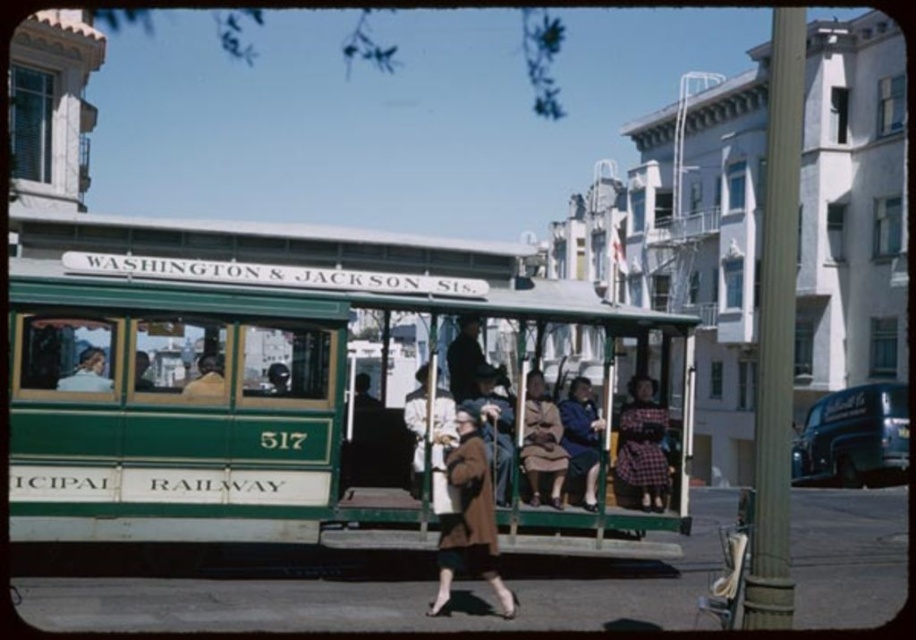
You are a tailor observing the two coats at the center of the scene. Which coat has a greater width, the brown wool coat at center or the brown fabric coat at center?

The brown wool coat at center has a greater width than the brown fabric coat at center, as stated in the description.

You are a photographer standing on the sidewalk and want to take a photo of both the green polished wood cable car at center and the brown fabric coat at center. Since you want both subjects to be clearly visible, which one should you focus on to ensure proper framing?

You should focus on the green polished wood cable car at center because it is larger in size than the brown fabric coat at center, making it easier to frame both subjects clearly.